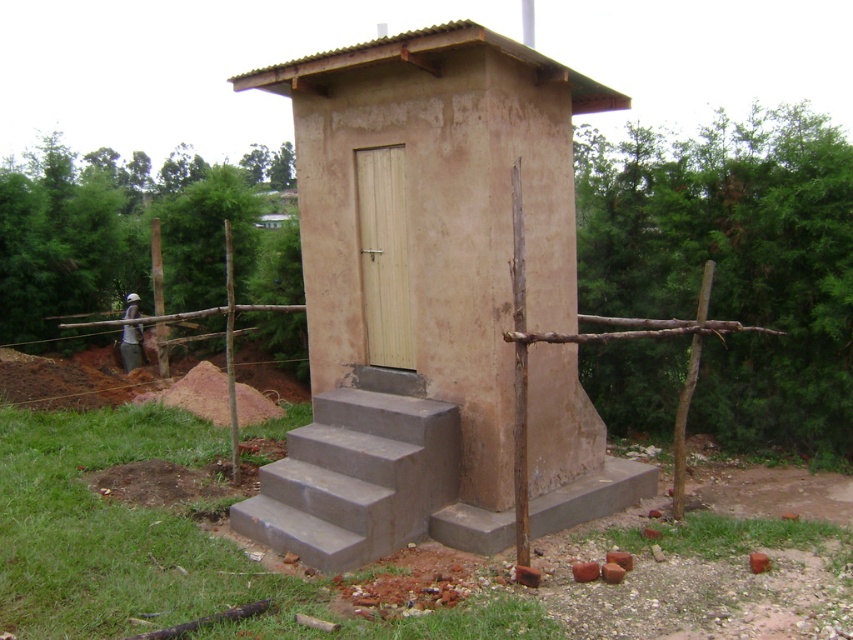
You are standing in front of the small outdoor toilet and need to enter it. There are two sets of gray concrete stairs at center and gray concrete steps at lower center. Which set should you use to approach the entrance?

You should use the gray concrete steps at lower center to approach the entrance because the gray concrete stairs at center is positioned on the left side of it, meaning the gray concrete steps at lower center is closer to the entrance.

You are a person with mobility issues who needs to access the entrance of the structure. You see the gray concrete stairs at center and the gray concrete steps at lower center. Which one would be easier for you to climb?

The gray concrete steps at lower center would be easier to climb because they have a smaller height compared to the gray concrete stairs at center.

You are standing on the ground level near the matte concrete hut at center and the gray concrete stairs at center. Which object is higher in elevation?

The matte concrete hut at center is located above the gray concrete stairs at center, so it is higher in elevation.